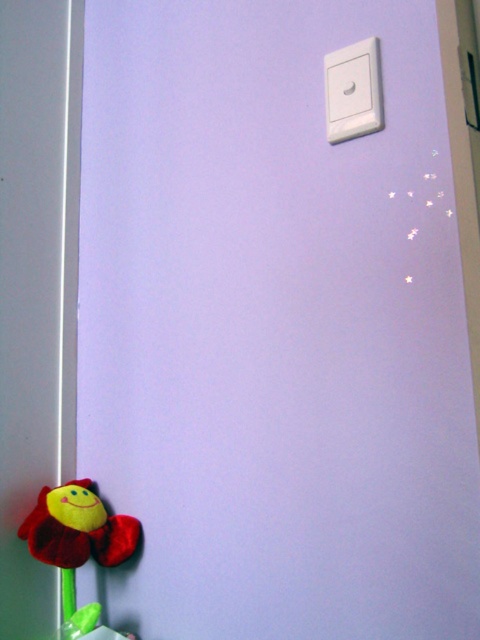
Does velvety red flower at bottom left come behind white plastic light switch at upper right?

Yes, it is.

At what (x,y) coordinates should I click in order to perform the action: click on velvety red flower at bottom left. Please return your answer as a coordinate pair (x, y). Looking at the image, I should click on [x=78, y=528].

Does point (104, 544) lie behind point (381, 77)?

Yes, it is behind point (381, 77).

Image resolution: width=480 pixels, height=640 pixels. I want to click on velvety red flower at bottom left, so click(78, 528).